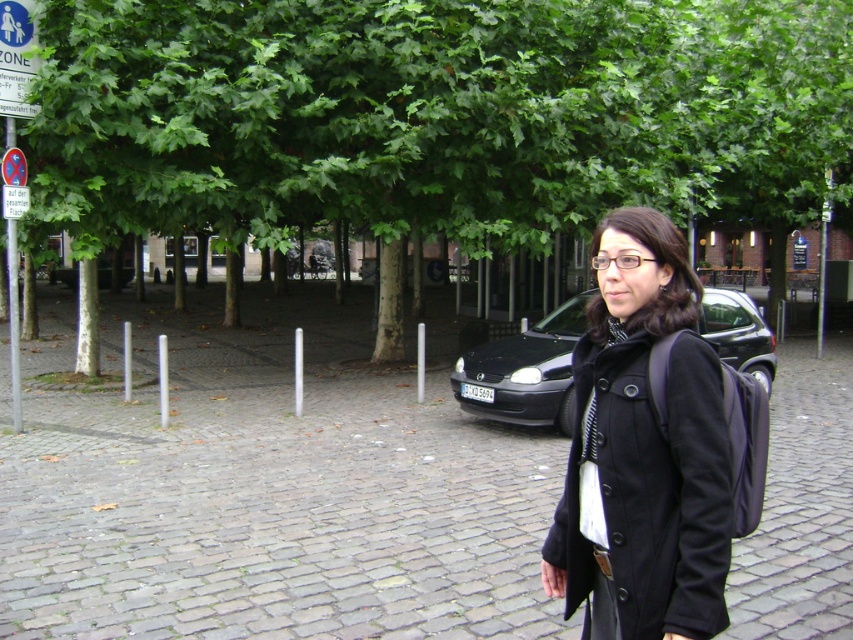
You are standing in the pedestrian area shown in the image. There is a gray cobblestone pavement at center marked by point (270,497). If you want to walk towards the woman walking towards the camera, should you move towards or away from the gray cobblestone pavement at center?

Since the woman is in the foreground and the gray cobblestone pavement at center is marked by point (270,497), you should move towards the gray cobblestone pavement at center to reach her because she is closer to that point.

You are a photographer standing in the plaza. You notice the green leafy tree at center and the black matte coat at center. Which object is wider from your perspective?

The green leafy tree at center is wider than the black matte coat at center.